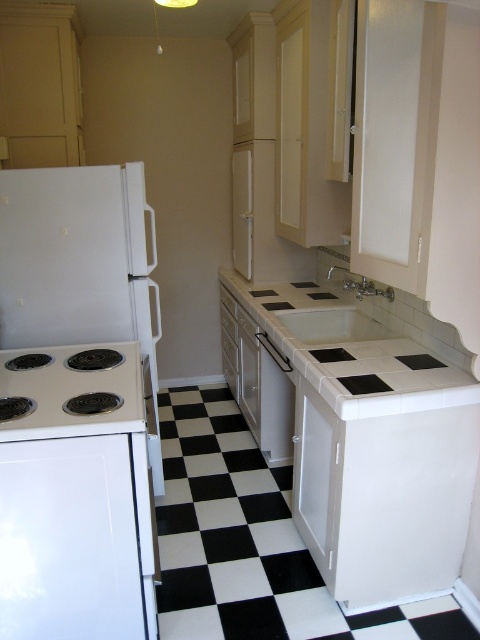
Is white glossy refrigerator at left closer to camera compared to white glossy electric stove at lower left?

No.

Does white glossy refrigerator at left lie behind white glossy electric stove at lower left?

Yes, it is behind white glossy electric stove at lower left.

Identify the location of white glossy refrigerator at left. (81, 264).

The height and width of the screenshot is (640, 480). What do you see at coordinates (355, 349) in the screenshot?
I see `white tile countertop at center` at bounding box center [355, 349].

Between white tile countertop at center and satin silver dishwasher at center, which one appears on the left side from the viewer's perspective?

satin silver dishwasher at center is more to the left.

Which is behind, point (295, 308) or point (276, 422)?

The point (276, 422) is behind.

Locate an element on the screen. The image size is (480, 640). white tile countertop at center is located at coordinates (355, 349).

Is white tile countertop at center taller than white glossy sink at center?

Indeed, white tile countertop at center has a greater height compared to white glossy sink at center.

Who is taller, white tile countertop at center or white glossy sink at center?

white tile countertop at center is taller.

At what (x,y) coordinates should I click in order to perform the action: click on white tile countertop at center. Please return your answer as a coordinate pair (x, y). The width and height of the screenshot is (480, 640). Looking at the image, I should click on (355, 349).